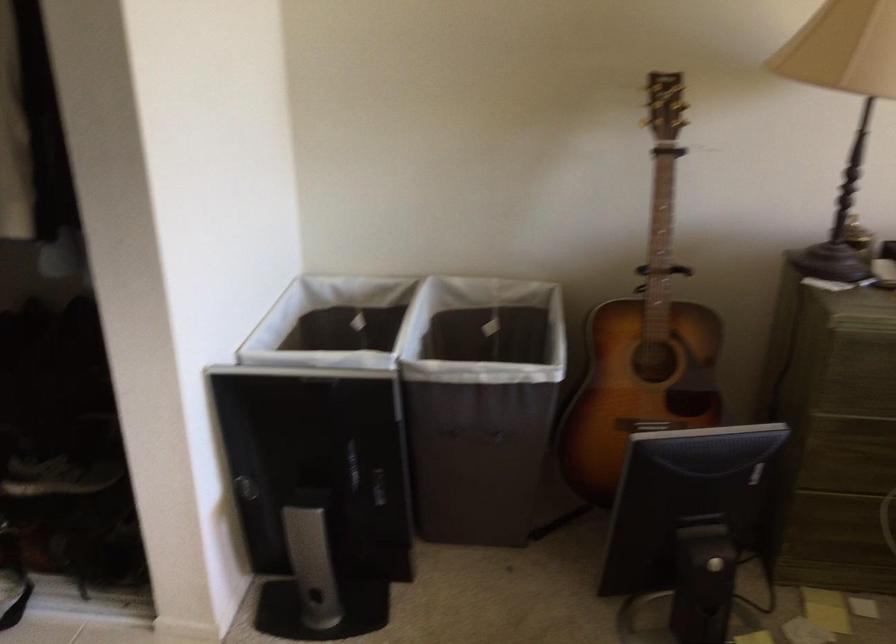
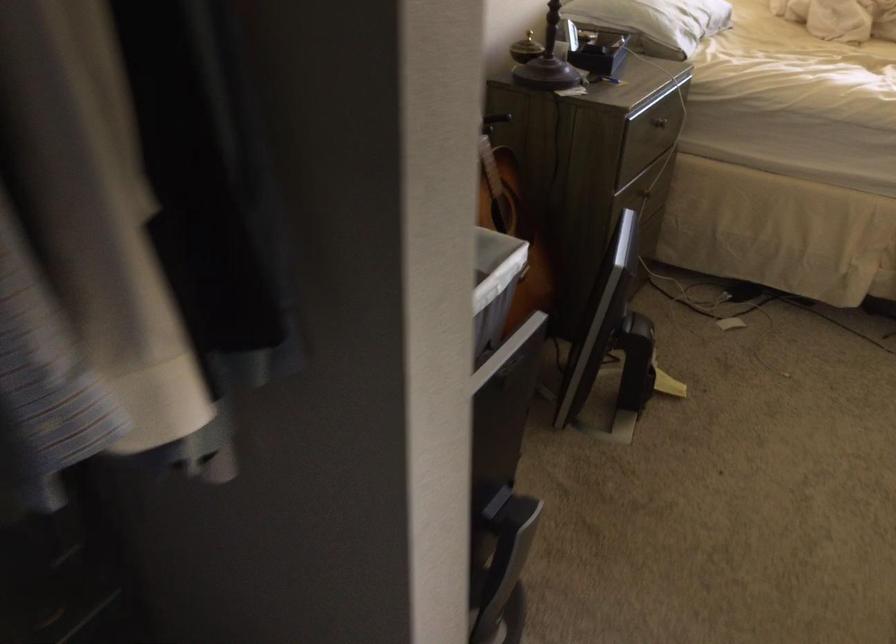
Locate, in the second image, the point that corresponds to (x=686, y=383) in the first image.

(513, 227)